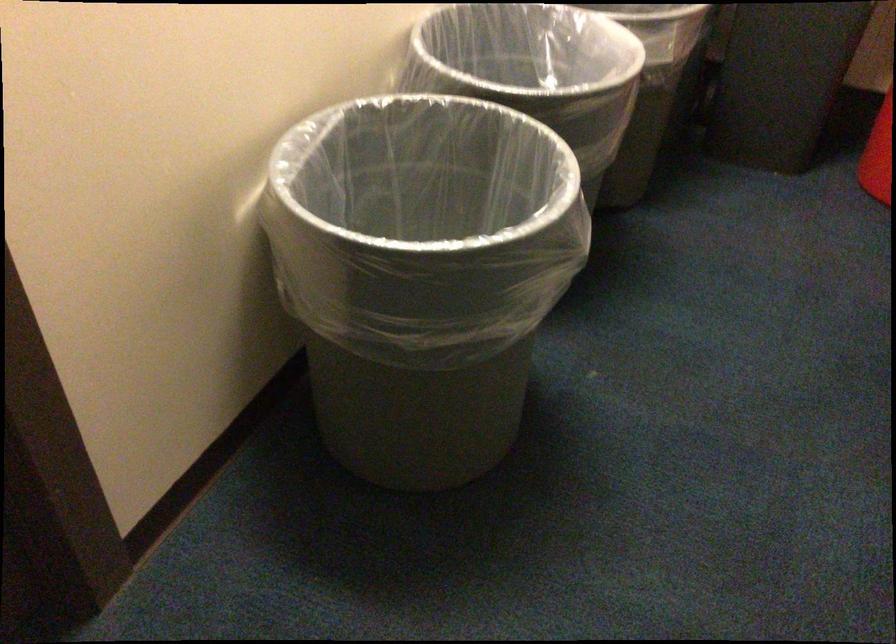
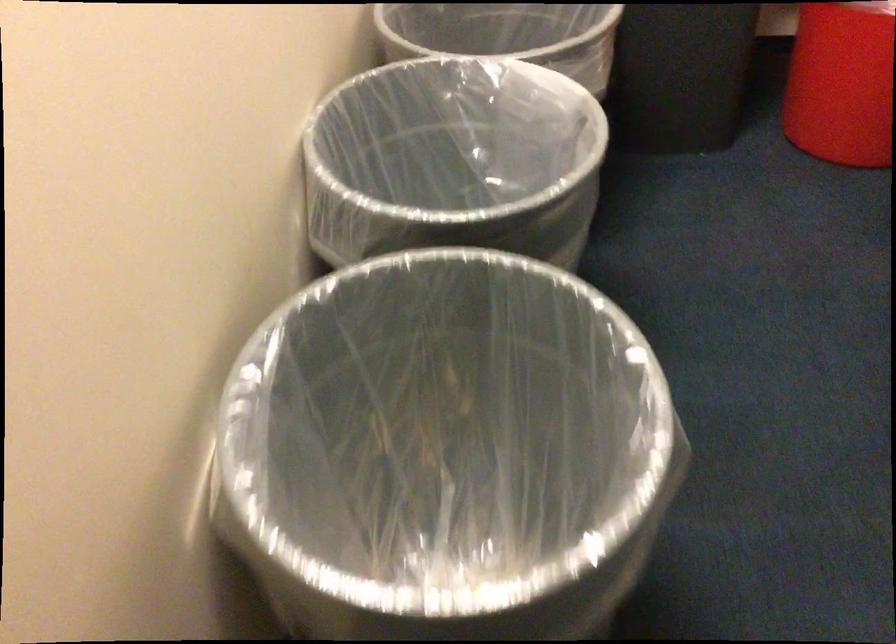
Question: The first image is from the beginning of the video and the second image is from the end. How did the camera likely rotate when shooting the video?

Choices:
 (A) Left
 (B) Right
 (C) Up
 (D) Down

Answer: (B)